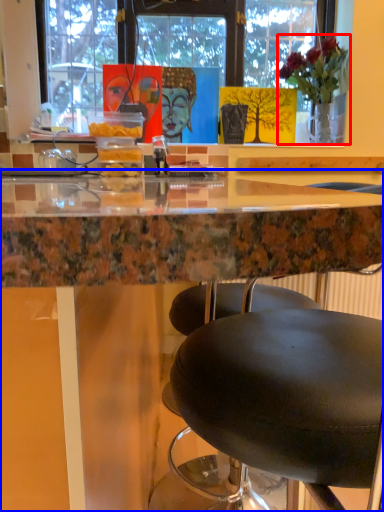
Question: Which object appears farthest to the camera in this image, houseplant (highlighted by a red box) or table (highlighted by a blue box)?

Choices:
 (A) houseplant
 (B) table

Answer: (A)